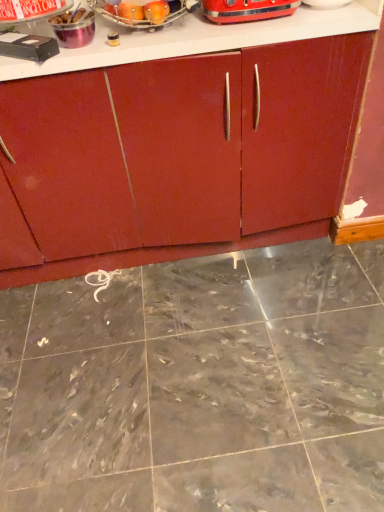
Where is `free spot in front of shiny metallic toaster at upper center, the fifth appliance when ordered from left to right`? This screenshot has width=384, height=512. free spot in front of shiny metallic toaster at upper center, the fifth appliance when ordered from left to right is located at coordinates (256, 29).